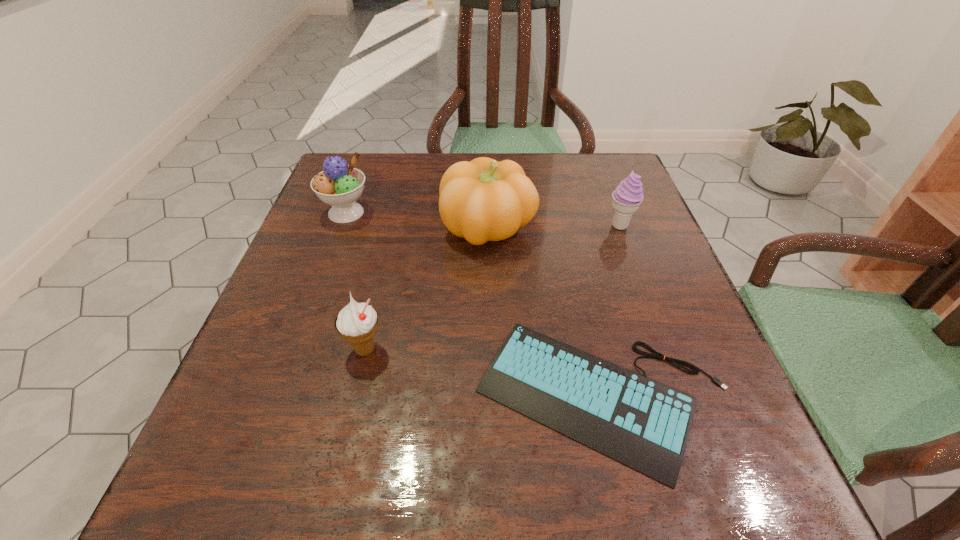
Where is `vacant point located between the nearest icecream and the pumpkin`? vacant point located between the nearest icecream and the pumpkin is located at coordinates (426, 288).

This screenshot has height=540, width=960. What are the coordinates of `vacant space that's between the pumpkin and the leftmost icecream` in the screenshot? It's located at (418, 220).

Where is `free space between the pumpkin and the computer keyboard`? free space between the pumpkin and the computer keyboard is located at coordinates (546, 312).

Image resolution: width=960 pixels, height=540 pixels. I want to click on the second closest object to the second icecream from left to right, so click(x=483, y=200).

Select which object is the closest to the leftmost icecream. Please provide its 2D coordinates. Your answer should be formatted as a tuple, i.e. [(x, y)], where the tuple contains the x and y coordinates of a point satisfying the conditions above.

[(483, 200)]

What are the coordinates of `icecream object that ranks as the third closest to the pumpkin` in the screenshot? It's located at (357, 323).

Where is `icecream that is the second closest one to the pumpkin`? The height and width of the screenshot is (540, 960). icecream that is the second closest one to the pumpkin is located at coordinates (339, 185).